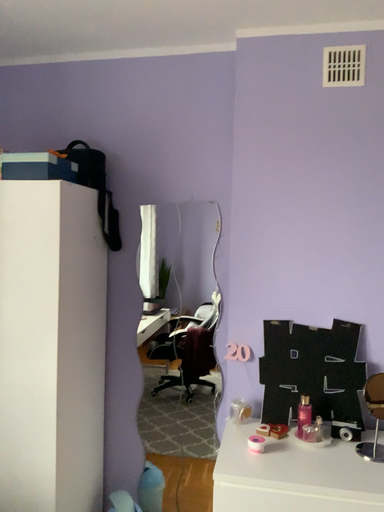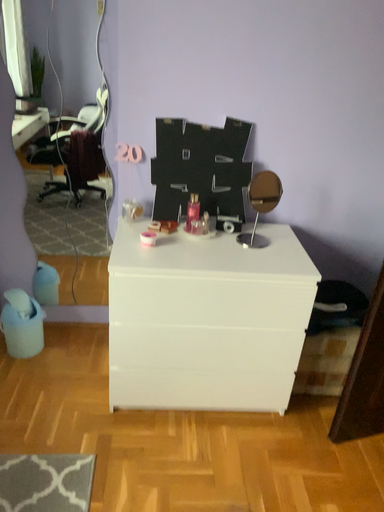
Question: Which way did the camera rotate in the video?

Choices:
 (A) rotated upward
 (B) rotated downward

Answer: (B)